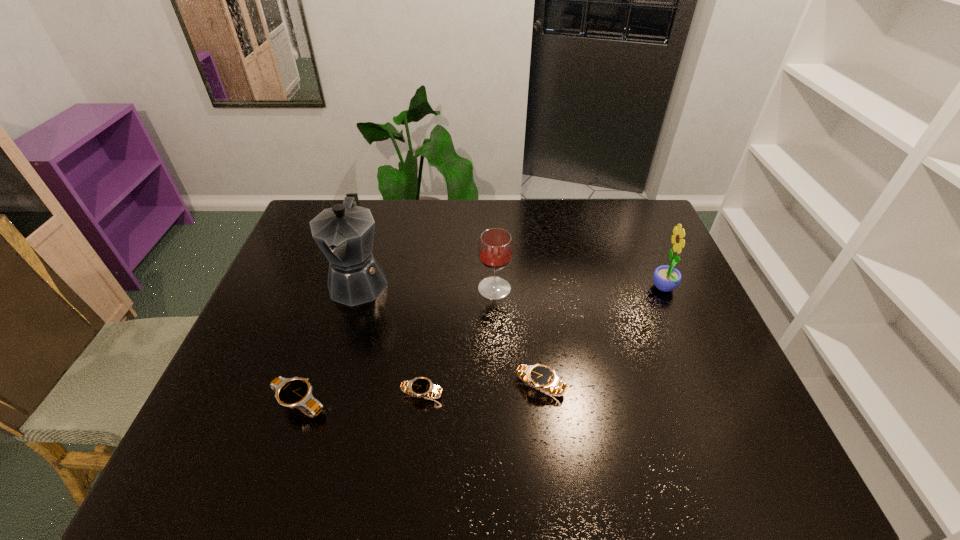
Locate an element on the screen. object that is at the near left corner is located at coordinates (295, 392).

Locate an element on the screen. The height and width of the screenshot is (540, 960). vacant area at the far edge of the desktop is located at coordinates (557, 204).

In the image, there is a desktop. Identify the location of vacant space at the near edge. The width and height of the screenshot is (960, 540). (543, 402).

In the image, there is a desktop. Identify the location of vacant area at the right edge. (680, 342).

This screenshot has height=540, width=960. Find the location of `free spot between the coffeepot and the second shortest watch`. free spot between the coffeepot and the second shortest watch is located at coordinates (449, 334).

Locate an element on the screen. The image size is (960, 540). blank region between the third object from left to right and the leftmost watch is located at coordinates (361, 399).

This screenshot has width=960, height=540. Find the location of `vacant space that's between the second watch from right to left and the second tallest object`. vacant space that's between the second watch from right to left and the second tallest object is located at coordinates (543, 342).

Identify the location of vacant space that is in between the tallest object and the rightmost watch. (449, 334).

Where is `free space between the rightmost object and the second watch from left to right`? This screenshot has width=960, height=540. free space between the rightmost object and the second watch from left to right is located at coordinates (543, 342).

I want to click on free point between the wineglass and the leftmost watch, so click(x=397, y=346).